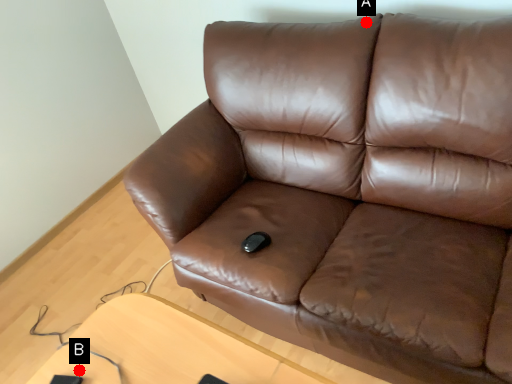
Question: Two points are circled on the image, labeled by A and B beside each circle. Which point is closer to the camera?

Choices:
 (A) A is closer
 (B) B is closer

Answer: (B)